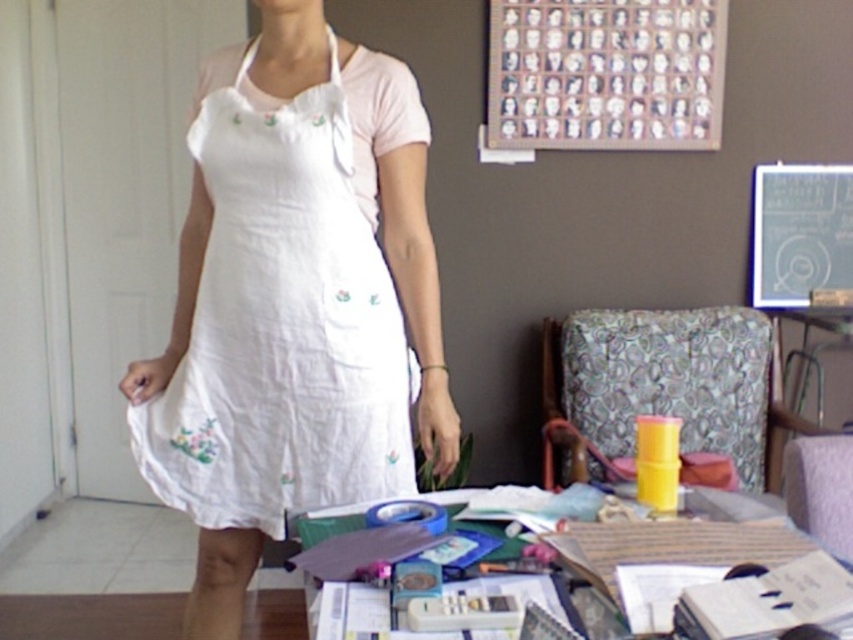
Question: Can you confirm if wooden frame at upper center is smaller than blackboard at upper center?

Choices:
 (A) no
 (B) yes

Answer: (A)

Question: Among these points, which one is farthest from the camera?

Choices:
 (A) (250, 356)
 (B) (619, 138)
 (C) (782, 268)

Answer: (C)

Question: Is wooden frame at upper center further to camera compared to blackboard at upper center?

Choices:
 (A) yes
 (B) no

Answer: (B)

Question: Is white cotton dress at center in front of wooden frame at upper center?

Choices:
 (A) no
 (B) yes

Answer: (B)

Question: Which object is positioned farthest from the blackboard at upper center?

Choices:
 (A) wooden frame at upper center
 (B) white cotton dress at center

Answer: (B)

Question: Estimate the real-world distances between objects in this image. Which object is closer to the wooden frame at upper center?

Choices:
 (A) white cotton dress at center
 (B) blackboard at upper center

Answer: (B)